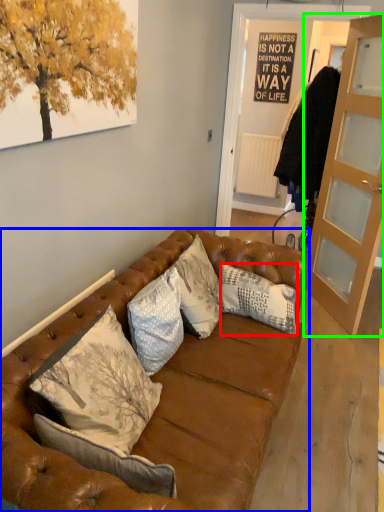
Question: Which object is the farthest from pillow (highlighted by a red box)? Choose among these: studio couch (highlighted by a blue box) or cabinetry (highlighted by a green box).

Choices:
 (A) studio couch
 (B) cabinetry

Answer: (B)